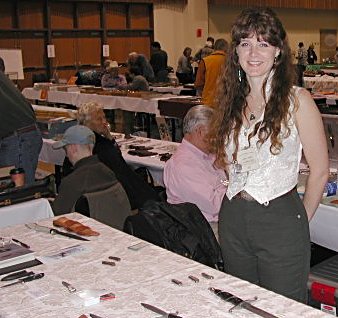
This screenshot has height=318, width=338. Find the location of `coffee cup`. coffee cup is located at coordinates (21, 181).